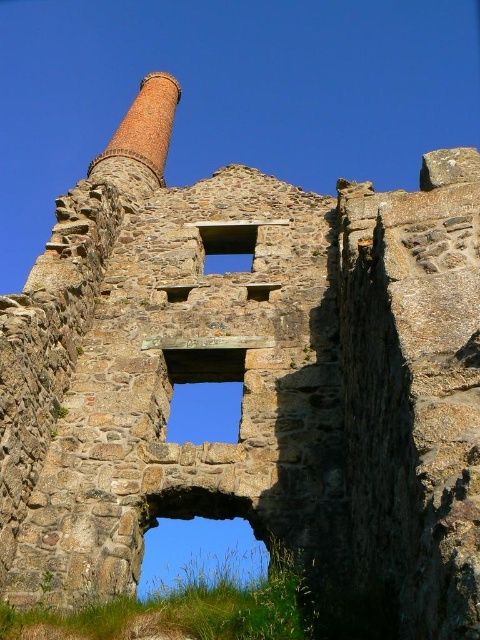
Question: Based on their relative distances, which object is nearer to the blue glass window at center?

Choices:
 (A) brick chimney at upper center
 (B) transparent stone window at center

Answer: (B)

Question: Which is farther from the brick chimney at upper center?

Choices:
 (A) transparent stone window at center
 (B) blue glass window at center

Answer: (A)

Question: Estimate the real-world distances between objects in this image. Which object is closer to the brick chimney at upper center?

Choices:
 (A) transparent stone window at center
 (B) blue glass window at center

Answer: (B)

Question: Observing the image, what is the correct spatial positioning of brick chimney at upper center in reference to blue glass window at center?

Choices:
 (A) left
 (B) right

Answer: (A)

Question: Observing the image, what is the correct spatial positioning of transparent stone window at center in reference to blue glass window at center?

Choices:
 (A) below
 (B) above

Answer: (A)

Question: Can you confirm if brick chimney at upper center is bigger than blue glass window at center?

Choices:
 (A) no
 (B) yes

Answer: (B)